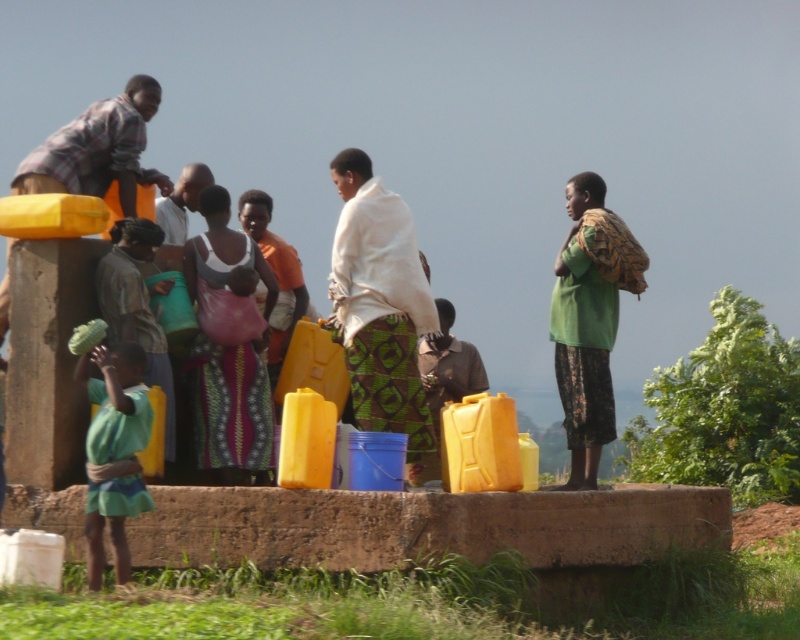
Question: Which point is farther to the camera?

Choices:
 (A) patterned fabric dress at center
 (B) green fabric shirt at lower left

Answer: (A)

Question: Which object is farther from the camera taking this photo?

Choices:
 (A) patterned fabric dress at center
 (B) green fabric shirt at lower left

Answer: (A)

Question: Can you confirm if patterned fabric dress at center is smaller than green fabric shirt at lower left?

Choices:
 (A) no
 (B) yes

Answer: (A)

Question: Is patterned fabric dress at center below green fabric shirt at lower left?

Choices:
 (A) no
 (B) yes

Answer: (A)

Question: Is patterned fabric dress at center below green fabric shirt at lower left?

Choices:
 (A) yes
 (B) no

Answer: (B)